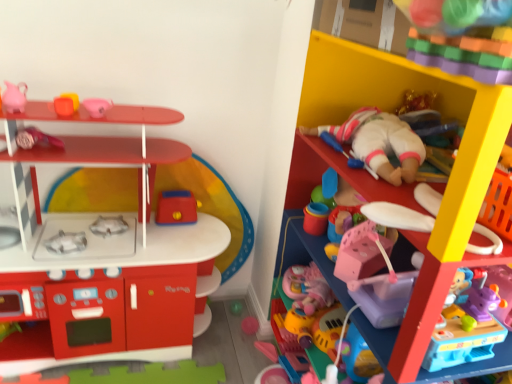
Question: Would you say matte plastic play kitchen at left, arranged as the 6th toy when viewed from the right, is inside or outside white plastic spoon at upper right, marked as the second toy in a right-to-left arrangement?

Choices:
 (A) inside
 (B) outside

Answer: (B)

Question: Considering the relative positions of matte plastic play kitchen at left, the fourth toy from the left, and white plastic spoon at upper right, marked as the second toy in a right-to-left arrangement, in the image provided, is matte plastic play kitchen at left, the fourth toy from the left, to the left or to the right of white plastic spoon at upper right, marked as the second toy in a right-to-left arrangement,?

Choices:
 (A) right
 (B) left

Answer: (B)

Question: Estimate the real-world distances between objects in this image. Which object is farther from the white plastic spoon at upper right, acting as the 8th toy starting from the left?

Choices:
 (A) rubberized red toaster at center, the sixth toy in the left-to-right sequence
 (B) pink matte pitcher at upper left, which is the 1th toy in left-to-right order
 (C) pink plastic house at center, marked as the 3th toy in a right-to-left arrangement
 (D) matte plastic shelf at upper right
 (E) matte plastic play kitchen at left, arranged as the 6th toy when viewed from the right

Answer: (B)

Question: Which is farther from the matte plastic shelf at upper right?

Choices:
 (A) white plastic spoon at upper right, acting as the 8th toy starting from the left
 (B) rubber duck at upper left, positioned as the third toy in left-to-right order
 (C) pink rubber duck at upper left, placed as the fifth toy when sorted from left to right
 (D) pastel plastic blocks at upper right, the ninth toy positioned from the left
 (E) pink plastic house at center, marked as the 3th toy in a right-to-left arrangement

Answer: (B)